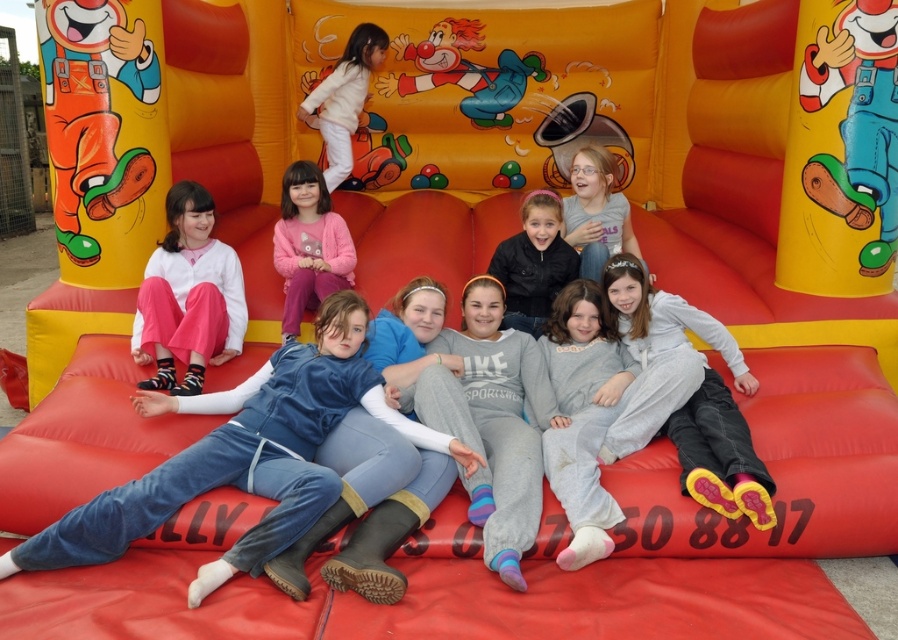
Question: Which point appears closest to the camera in this image?

Choices:
 (A) (180, 256)
 (B) (619, 257)

Answer: (B)

Question: Does light gray fleece pants at center lie behind pink fleece sweater at center?

Choices:
 (A) yes
 (B) no

Answer: (B)

Question: Which of the following is the closest to the observer?

Choices:
 (A) (627, 264)
 (B) (517, 301)
 (C) (317, 289)
 (D) (207, 248)

Answer: (A)

Question: Is pink fleece sweater at center further to the viewer compared to white fluffy cloud at upper center?

Choices:
 (A) no
 (B) yes

Answer: (A)

Question: Among these objects, which one is farthest from the camera?

Choices:
 (A) blue denim pants at lower left
 (B) pink fleece sweater at center
 (C) light gray fleece pants at center

Answer: (B)

Question: Is matte pink pants at lower left to the right of pink fleece sweater at center from the viewer's perspective?

Choices:
 (A) no
 (B) yes

Answer: (A)